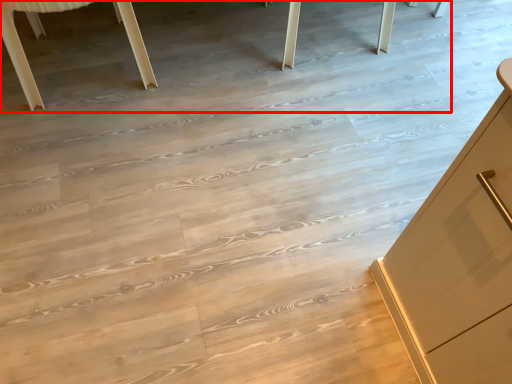
Question: From the image, what is the correct spatial relationship of table (annotated by the red box) in relation to furniture?

Choices:
 (A) left
 (B) right

Answer: (B)